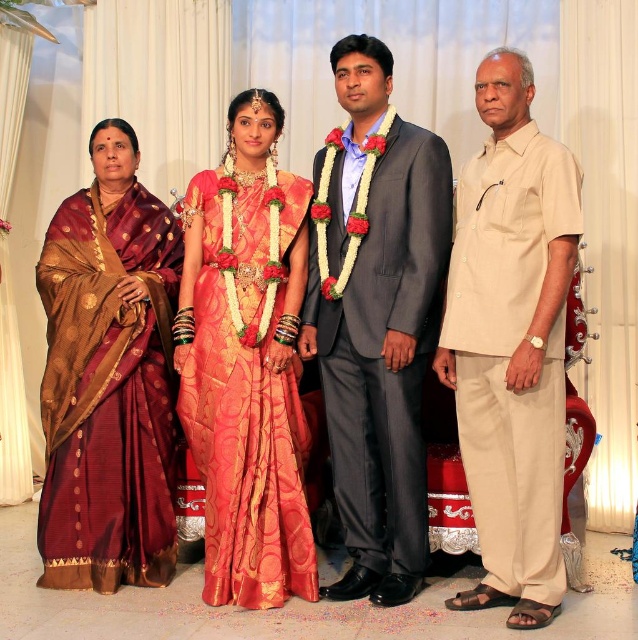
Is matte gray suit at center to the right of silk saree at center from the viewer's perspective?

Correct, you'll find matte gray suit at center to the right of silk saree at center.

Does matte gray suit at center lie behind silk saree at center?

Yes.

Measure the distance between matte gray suit at center and camera.

matte gray suit at center and camera are 9.83 feet apart from each other.

This screenshot has height=640, width=638. I want to click on matte gray suit at center, so click(x=376, y=317).

Is matte gray suit at center to the left of maroon silk saree at left from the viewer's perspective?

In fact, matte gray suit at center is to the right of maroon silk saree at left.

Image resolution: width=638 pixels, height=640 pixels. I want to click on matte gray suit at center, so click(376, 317).

Is beige cotton kurta at right thinner than maroon silk saree at left?

Correct, beige cotton kurta at right's width is less than maroon silk saree at left's.

Does beige cotton kurta at right appear over maroon silk saree at left?

Indeed, beige cotton kurta at right is positioned over maroon silk saree at left.

Does point (516, 211) lie in front of point (158, 417)?

Yes, it is in front of point (158, 417).

At what (x,y) coordinates should I click in order to perform the action: click on beige cotton kurta at right. Please return your answer as a coordinate pair (x, y). The height and width of the screenshot is (640, 638). Looking at the image, I should click on (512, 342).